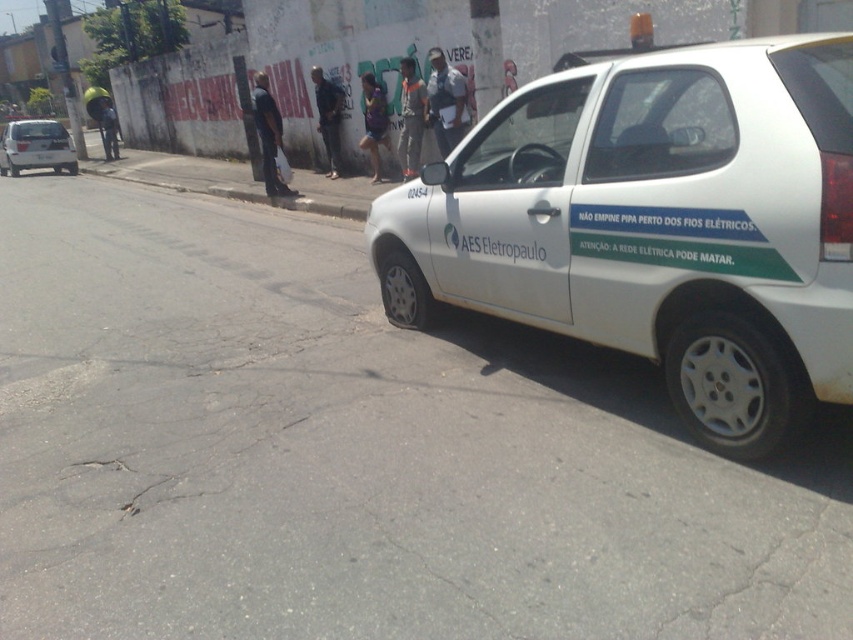
In the scene shown: You are a pedestrian standing in the middle of the street. You see a white matte car at right and a white matte car at left. Which car is closer to you?

The white matte car at right is closer to you because it is smaller than the white matte car at left.

You are a delivery driver who needs to park your truck between the white matte car at right and the white matte car at left. Your truck is 2.5 meters wide. Can you fit your truck between them?

The white matte car at right has a lesser width compared to the white matte car at left. Therefore, the space between them may not be sufficient for a truck that is 2.5 meters wide. You should check the actual distance between the cars before deciding to park.